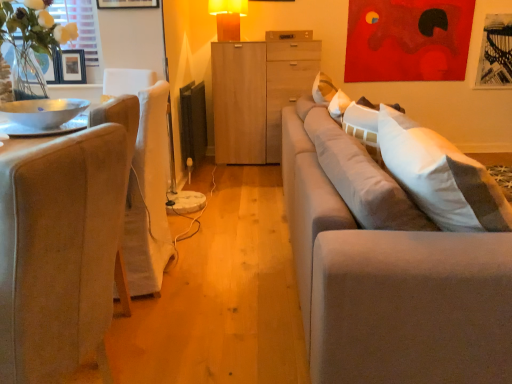
Question: Is beige fabric chair at left facing away from matte yellow plastic table lamp at upper center?

Choices:
 (A) yes
 (B) no

Answer: (B)

Question: Is beige fabric chair at left far away from matte yellow plastic table lamp at upper center?

Choices:
 (A) yes
 (B) no

Answer: (A)

Question: Is beige fabric chair at left wider than matte yellow plastic table lamp at upper center?

Choices:
 (A) yes
 (B) no

Answer: (A)

Question: Is beige fabric chair at left in contact with matte yellow plastic table lamp at upper center?

Choices:
 (A) yes
 (B) no

Answer: (B)

Question: Is beige fabric chair at left positioned beyond the bounds of matte yellow plastic table lamp at upper center?

Choices:
 (A) yes
 (B) no

Answer: (A)

Question: Can you confirm if beige fabric chair at left is thinner than matte yellow plastic table lamp at upper center?

Choices:
 (A) yes
 (B) no

Answer: (B)

Question: Does light gray fabric couch at right contain metallic silver bowl at left?

Choices:
 (A) no
 (B) yes

Answer: (A)

Question: Considering the relative sizes of light gray fabric couch at right and metallic silver bowl at left in the image provided, is light gray fabric couch at right wider than metallic silver bowl at left?

Choices:
 (A) yes
 (B) no

Answer: (A)

Question: From a real-world perspective, is light gray fabric couch at right on metallic silver bowl at left?

Choices:
 (A) no
 (B) yes

Answer: (A)

Question: Considering the relative sizes of light gray fabric couch at right and metallic silver bowl at left in the image provided, is light gray fabric couch at right bigger than metallic silver bowl at left?

Choices:
 (A) yes
 (B) no

Answer: (A)

Question: Can you confirm if light gray fabric couch at right is thinner than metallic silver bowl at left?

Choices:
 (A) yes
 (B) no

Answer: (B)

Question: Can we say light gray fabric couch at right lies outside metallic silver bowl at left?

Choices:
 (A) yes
 (B) no

Answer: (A)

Question: Is metallic silver bowl at left oriented away from wooden drawer at center?

Choices:
 (A) no
 (B) yes

Answer: (A)